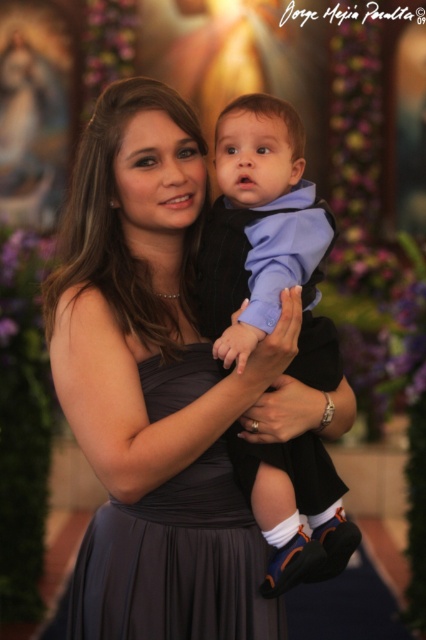
Find the location of a particular element. This screenshot has width=426, height=640. matte gray dress at center is located at coordinates (158, 387).

What do you see at coordinates (158, 387) in the screenshot?
I see `matte gray dress at center` at bounding box center [158, 387].

At what (x,y) coordinates should I click in order to perform the action: click on matte gray dress at center. Please return your answer as a coordinate pair (x, y). The width and height of the screenshot is (426, 640). Looking at the image, I should click on tap(158, 387).

Can you confirm if matte gray dress at center is positioned to the left of dark gray satin dress at center?

No, matte gray dress at center is not to the left of dark gray satin dress at center.

Can you confirm if matte gray dress at center is taller than dark gray satin dress at center?

Indeed, matte gray dress at center has a greater height compared to dark gray satin dress at center.

Locate an element on the screen. Image resolution: width=426 pixels, height=640 pixels. matte gray dress at center is located at coordinates (158, 387).

Does point (267, 580) come farther from viewer compared to point (172, 388)?

No.

The image size is (426, 640). I want to click on matte black vest at center, so click(264, 237).